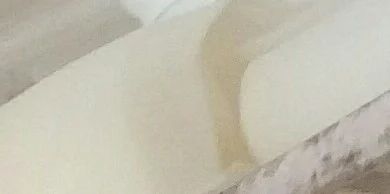
Identify the location of foam rolls. (73, 134), (299, 81).